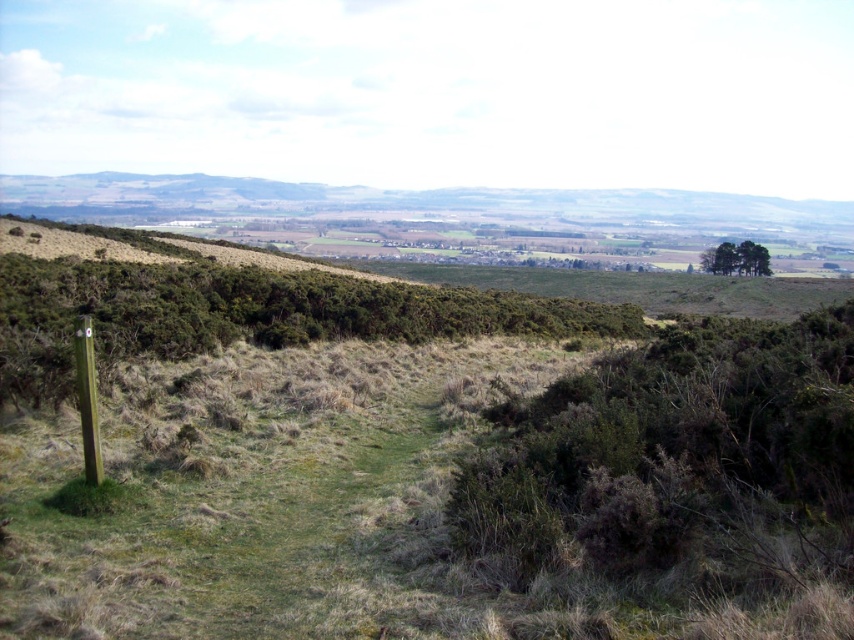
Question: Which object is the closest to the green leafy shrubs at lower left?

Choices:
 (A) green wooden pole at left
 (B) green leafy trees at upper right

Answer: (A)

Question: Estimate the real-world distances between objects in this image. Which object is farther from the green leafy trees at upper right?

Choices:
 (A) green leafy shrubs at lower left
 (B) green wooden pole at left

Answer: (B)

Question: Which object appears closest to the camera in this image?

Choices:
 (A) green leafy shrubs at lower left
 (B) green leafy trees at upper right

Answer: (A)

Question: Can you confirm if green wooden pole at left is thinner than green leafy trees at upper right?

Choices:
 (A) yes
 (B) no

Answer: (A)

Question: Can you confirm if green leafy shrubs at lower left is positioned above green wooden pole at left?

Choices:
 (A) no
 (B) yes

Answer: (B)

Question: Is green leafy shrubs at lower left thinner than green leafy trees at upper right?

Choices:
 (A) no
 (B) yes

Answer: (A)